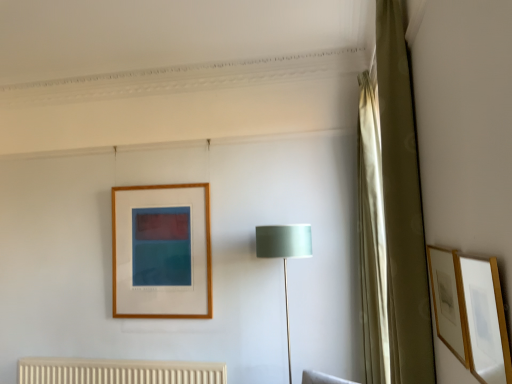
Question: From the image's perspective, is satin green fabric at center under matte gold picture frame at right, the 2th picture frame from the back?

Choices:
 (A) yes
 (B) no

Answer: (A)

Question: Does satin green fabric at center lie in front of matte gold picture frame at right, which is the 1th picture frame from front to back?

Choices:
 (A) no
 (B) yes

Answer: (A)

Question: Is satin green fabric at center turned away from matte gold picture frame at right, the 2th picture frame from the back?

Choices:
 (A) no
 (B) yes

Answer: (A)

Question: From the image's perspective, is satin green fabric at center above matte gold picture frame at right, the 2th picture frame from the back?

Choices:
 (A) no
 (B) yes

Answer: (A)

Question: Can you confirm if satin green fabric at center is bigger than matte gold picture frame at right, which is the 1th picture frame from front to back?

Choices:
 (A) yes
 (B) no

Answer: (A)

Question: Choose the correct answer: Is green fabric curtain at right, positioned as the 2th curtain in back-to-front order, inside silky gold curtain at right, acting as the 2th curtain starting from the front, or outside it?

Choices:
 (A) outside
 (B) inside

Answer: (A)

Question: Considering the positions of green fabric curtain at right, the first curtain viewed from the front, and silky gold curtain at right, which is counted as the first curtain, starting from the back, in the image, is green fabric curtain at right, the first curtain viewed from the front, wider or thinner than silky gold curtain at right, which is counted as the first curtain, starting from the back,?

Choices:
 (A) wide
 (B) thin

Answer: (B)

Question: Is green fabric curtain at right, positioned as the 2th curtain in back-to-front order, in front of or behind silky gold curtain at right, which is counted as the first curtain, starting from the back, in the image?

Choices:
 (A) front
 (B) behind

Answer: (A)

Question: Is point (406, 213) positioned closer to the camera than point (380, 289)?

Choices:
 (A) closer
 (B) farther

Answer: (A)

Question: From the image's perspective, is green fabric curtain at right, positioned as the 2th curtain in back-to-front order, positioned above or below wooden picture frame at right, the 1th picture frame in the back-to-front sequence?

Choices:
 (A) below
 (B) above

Answer: (B)

Question: Relative to wooden picture frame at right, arranged as the 2th picture frame when viewed from the front, is green fabric curtain at right, positioned as the 2th curtain in back-to-front order, in front or behind?

Choices:
 (A) front
 (B) behind

Answer: (B)

Question: Considering the positions of green fabric curtain at right, the first curtain viewed from the front, and wooden picture frame at right, the 1th picture frame in the back-to-front sequence, in the image, is green fabric curtain at right, the first curtain viewed from the front, taller or shorter than wooden picture frame at right, the 1th picture frame in the back-to-front sequence,?

Choices:
 (A) tall
 (B) short

Answer: (A)

Question: Is point (401, 329) closer or farther from the camera than point (458, 317)?

Choices:
 (A) farther
 (B) closer

Answer: (A)

Question: Looking at their shapes, would you say matte gold picture frame at right, the 2th picture frame from the back, is wider or thinner than satin green fabric at center?

Choices:
 (A) thin
 (B) wide

Answer: (A)

Question: Which is correct: matte gold picture frame at right, which is the 1th picture frame from front to back, is inside satin green fabric at center, or outside of it?

Choices:
 (A) inside
 (B) outside

Answer: (B)